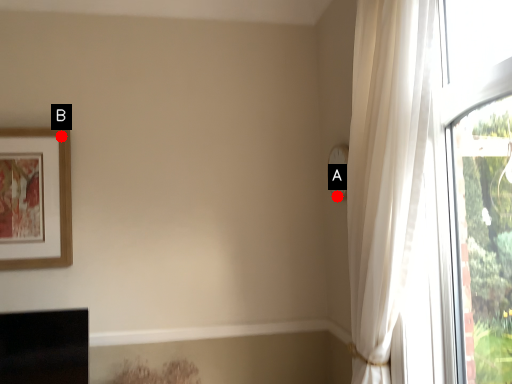
Question: Two points are circled on the image, labeled by A and B beside each circle. Among these points, which one is farthest from the camera?

Choices:
 (A) A is further
 (B) B is further

Answer: (A)